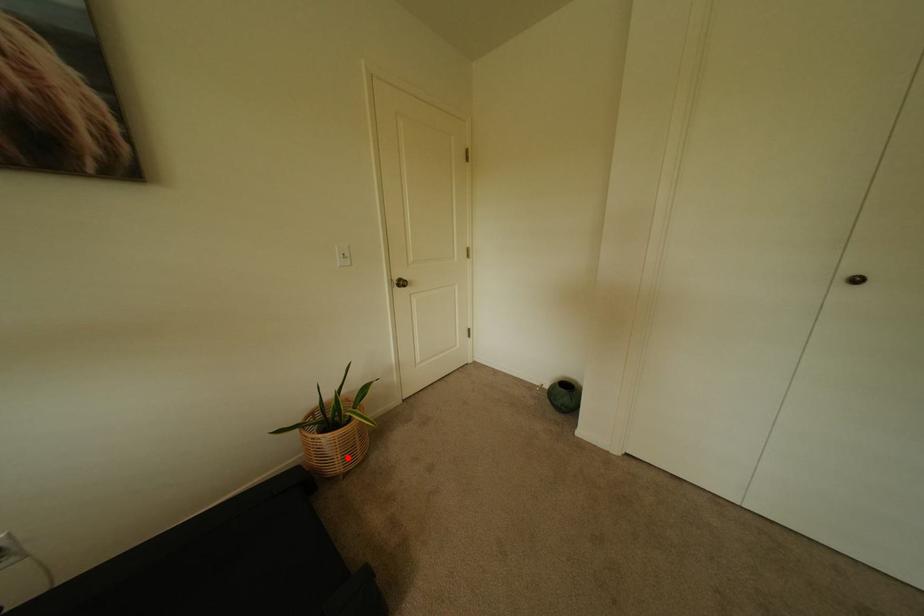
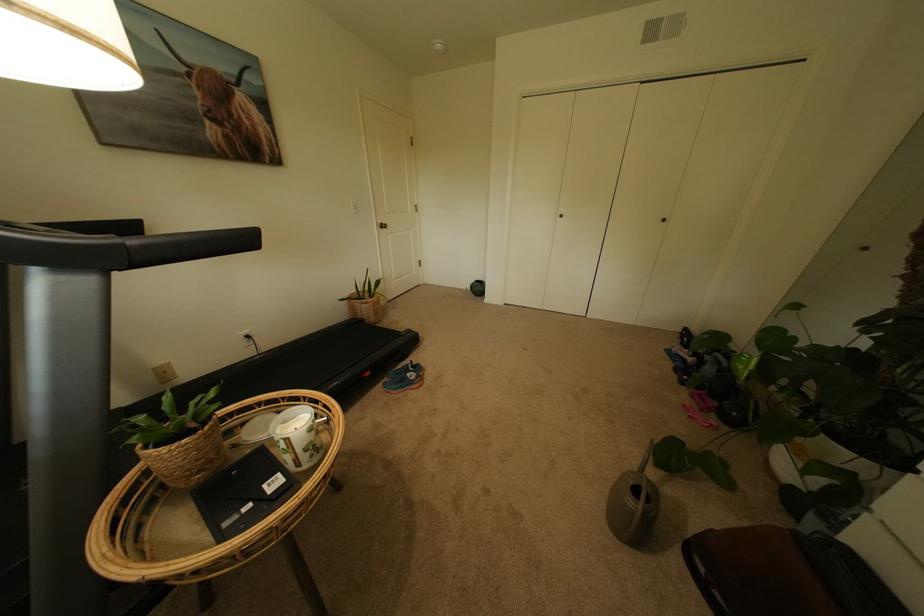
Find the pixel in the second image that matches the highlighted location in the first image.

(382, 314)